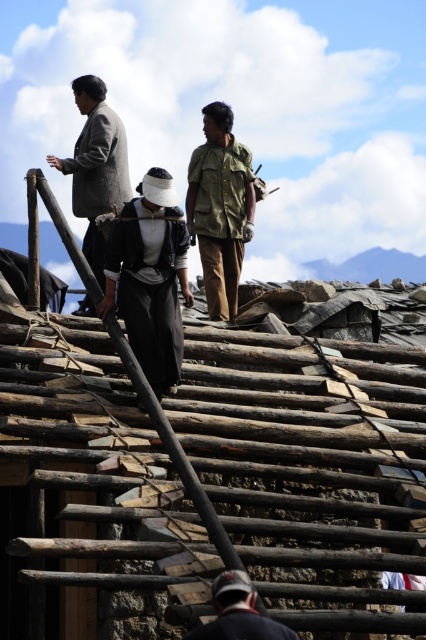
Between point (216, 308) and point (275, 630), which one is positioned behind?

Positioned behind is point (216, 308).

Does matte khaki shirt at center have a greater height compared to dark blue fabric cap at lower center?

Yes, matte khaki shirt at center is taller than dark blue fabric cap at lower center.

What do you see at coordinates (219, 209) in the screenshot?
I see `matte khaki shirt at center` at bounding box center [219, 209].

Locate an element on the screen. This screenshot has height=640, width=426. matte khaki shirt at center is located at coordinates (219, 209).

Can you confirm if dark gray fabric construction worker at center is shorter than dark blue fabric cap at lower center?

Incorrect, dark gray fabric construction worker at center's height does not fall short of dark blue fabric cap at lower center's.

Locate an element on the screen. dark gray fabric construction worker at center is located at coordinates (149, 276).

Between point (164, 349) and point (204, 634), which one is positioned behind?

Point (164, 349)

Locate an element on the screen. The width and height of the screenshot is (426, 640). dark gray fabric construction worker at center is located at coordinates (149, 276).

Between point (124, 218) and point (209, 266), which one is positioned behind?

Positioned behind is point (209, 266).

Does point (183, 292) lie behind point (224, 244)?

No, (183, 292) is closer to viewer.

Who is more forward, (166, 317) or (210, 317)?

Point (166, 317) is in front.

At what (x,y) coordinates should I click in order to perform the action: click on dark gray fabric construction worker at center. Please return your answer as a coordinate pair (x, y). This screenshot has height=640, width=426. Looking at the image, I should click on (149, 276).